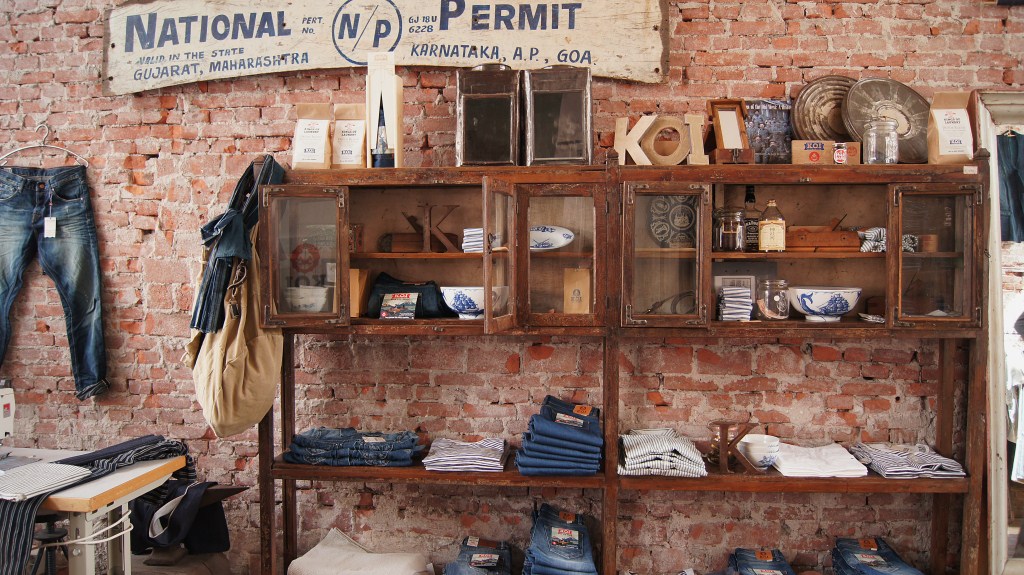
Find the location of `brick wall`. brick wall is located at coordinates (849, 30).